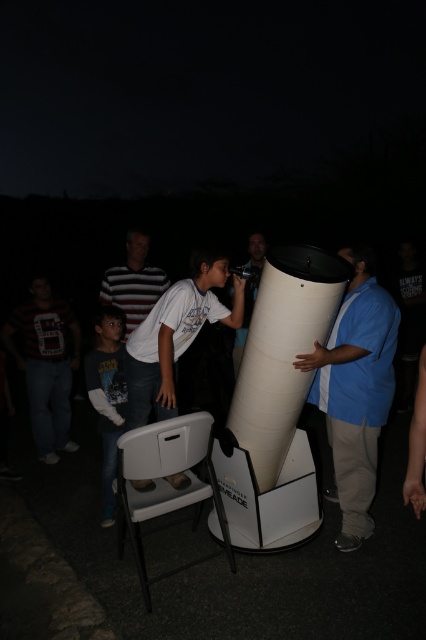
Question: Does blue fabric shirt at center lie in front of white plastic chair at lower center?

Choices:
 (A) yes
 (B) no

Answer: (B)

Question: Among these objects, which one is nearest to the camera?

Choices:
 (A) blue fabric shirt at center
 (B) white matte shirt at center
 (C) dark blue shirt at lower left
 (D) white plastic chair at lower center

Answer: (D)

Question: Can you confirm if white matte shirt at center is positioned to the left of striped cotton shirt at center?

Choices:
 (A) no
 (B) yes

Answer: (A)

Question: Is white matte shirt at center to the right of matte black telescope at center from the viewer's perspective?

Choices:
 (A) yes
 (B) no

Answer: (B)

Question: Which point is farther to the camera?

Choices:
 (A) tap(144, 316)
 (B) tap(152, 436)

Answer: (A)

Question: Which of the following is the closest to the observer?

Choices:
 (A) white matte shirt at center
 (B) striped cotton shirt at center

Answer: (A)